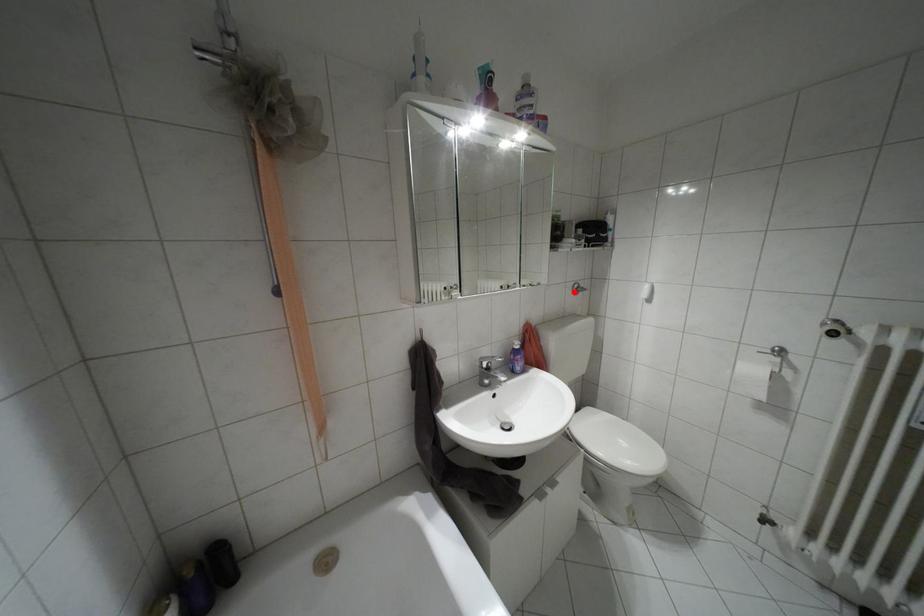
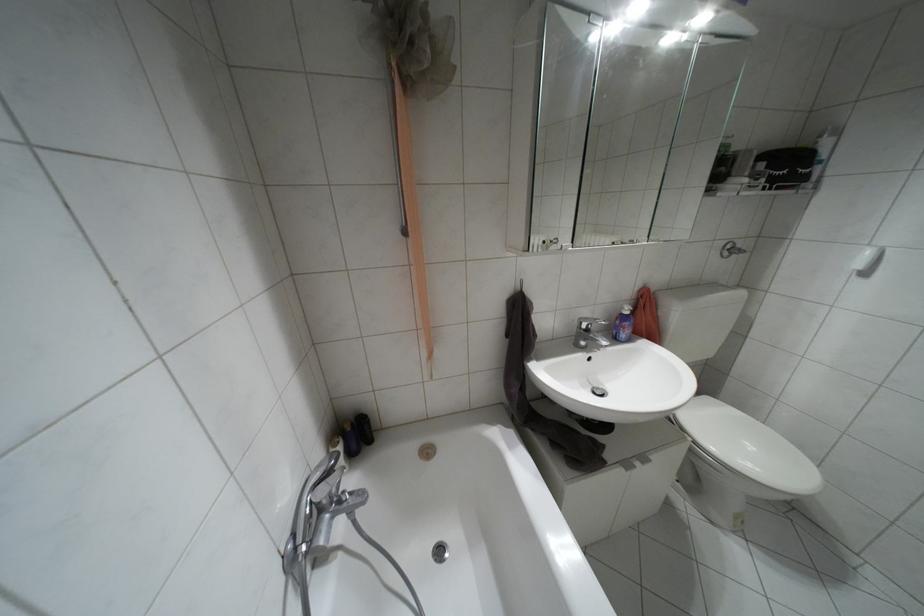
In the second image, find the point that corresponds to the highlighted location in the first image.

(723, 254)